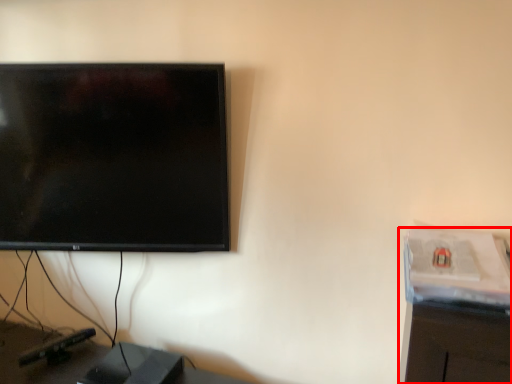
Question: From the image's perspective, where is computer desk (annotated by the red box) located in relation to furniture in the image?

Choices:
 (A) above
 (B) below

Answer: (A)